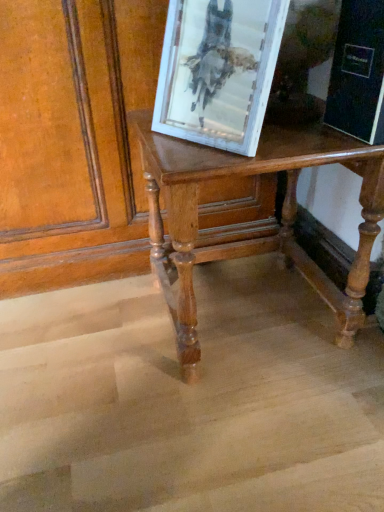
Find the location of a particular element. The image size is (384, 512). blank space situated above shiny polished wood table at center (from a real-world perspective) is located at coordinates (268, 132).